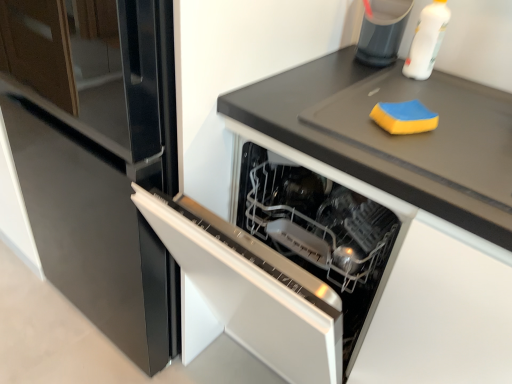
Locate an element on the screen. Image resolution: width=512 pixels, height=384 pixels. vacant area that lies between yellow sponge at upper right and white plastic bottle at upper right is located at coordinates (412, 90).